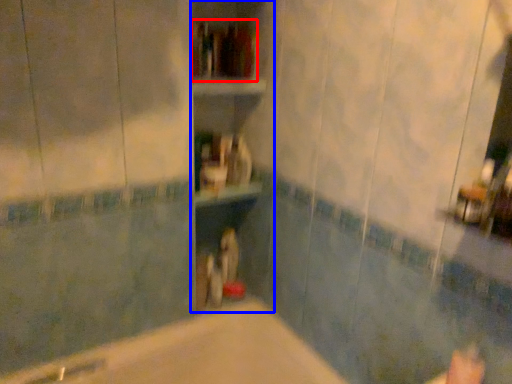
Question: Which point is further to the camera, book (highlighted by a red box) or bookshelf (highlighted by a blue box)?

Choices:
 (A) book
 (B) bookshelf

Answer: (A)